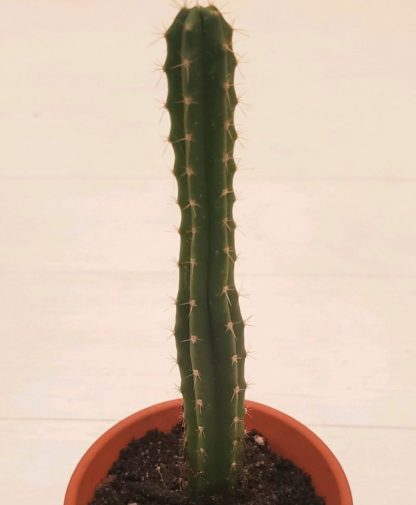
Where is `light colored wood background`? This screenshot has width=416, height=505. light colored wood background is located at coordinates pos(74,59), pos(73,218), pos(67,368), pos(344,388), pos(334,235), pos(339,61).